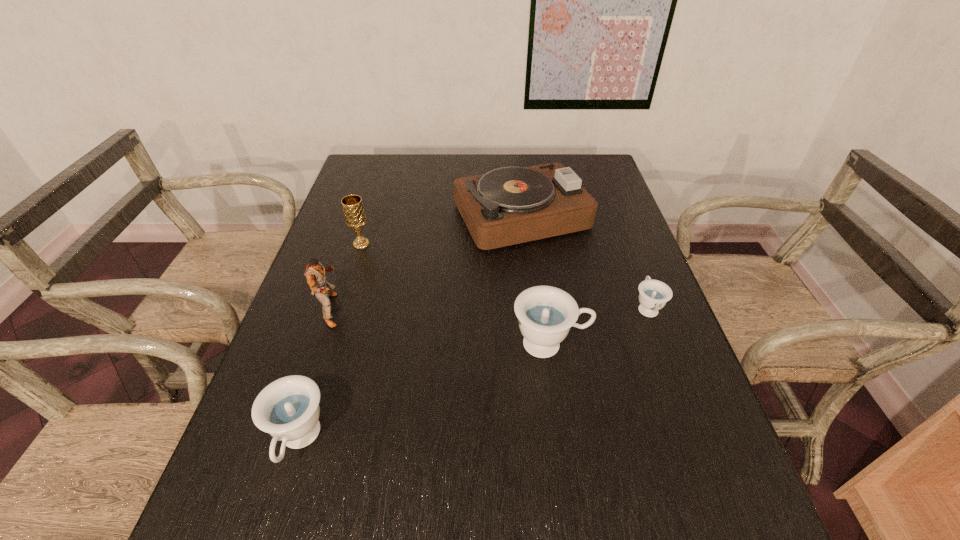
Where is `teacup that is the second closest to the chalice`? The image size is (960, 540). teacup that is the second closest to the chalice is located at coordinates (288, 409).

In order to click on teacup that is the nearest to the puncher in this screenshot , I will do `click(288, 409)`.

The image size is (960, 540). Identify the location of free space that satisfies the following two spatial constraints: 1. on the side of the second teacup from right to left with the handle; 2. on the side of the second shortest teacup with the handle. (564, 441).